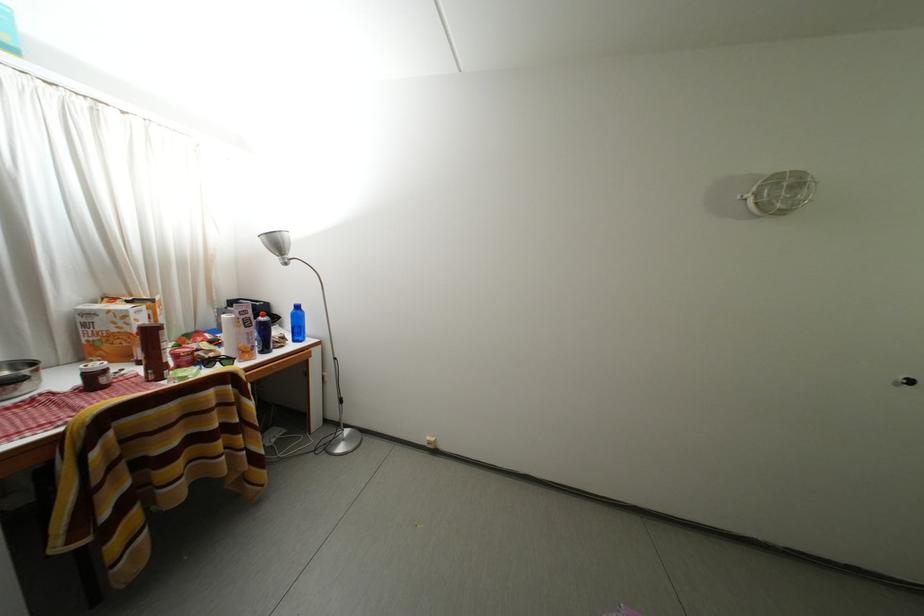
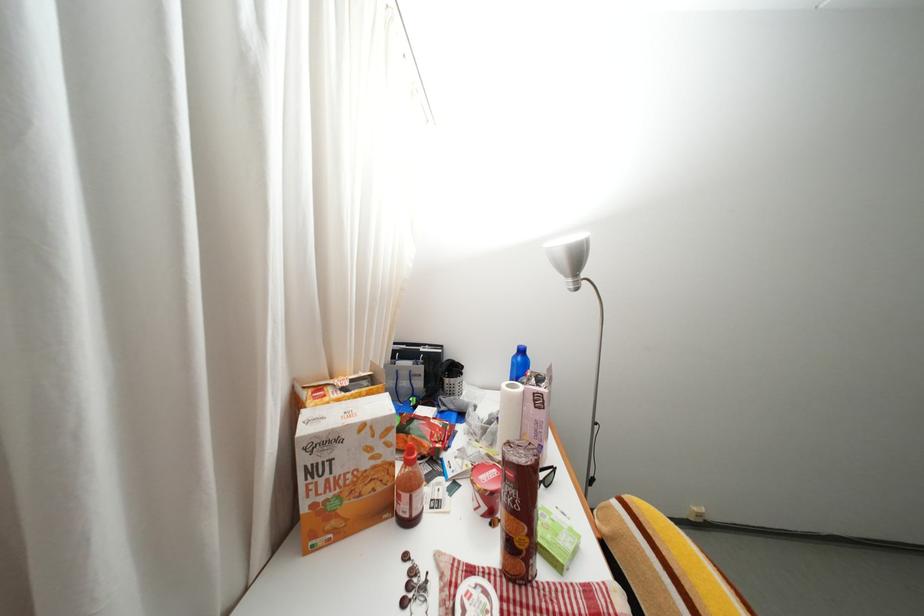
What movement of the cameraman would produce the second image?

The cameraman walked toward left, forward.